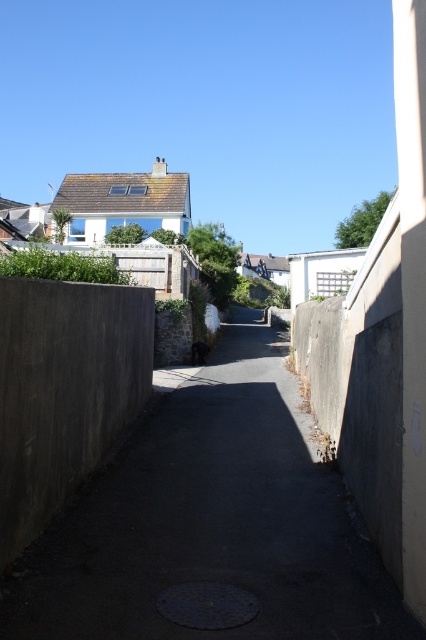
Between dark concrete path at center and concrete wall at left, which one appears on the right side from the viewer's perspective?

dark concrete path at center

Find the location of a particular element. This screenshot has height=640, width=426. dark concrete path at center is located at coordinates (212, 525).